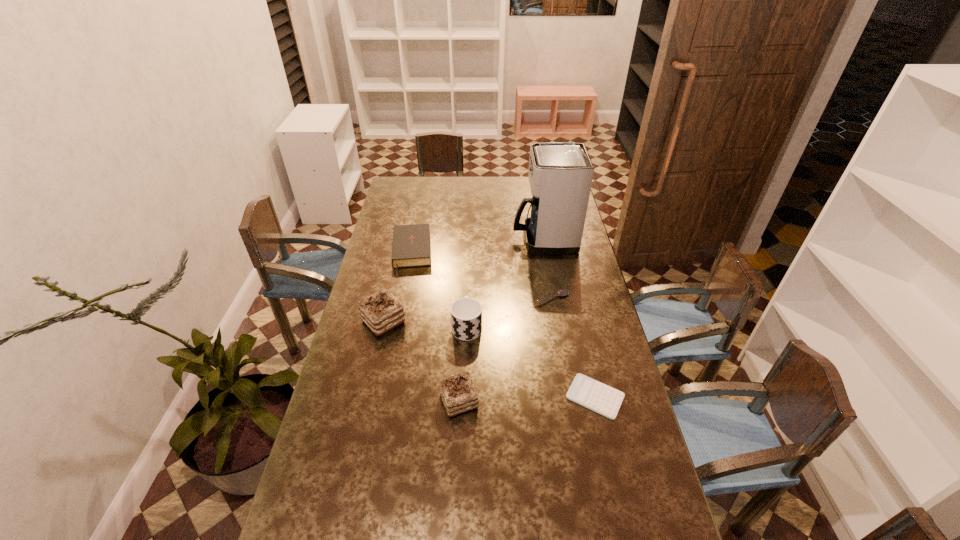
What are the coordinates of `chocolate cake positioned at the left edge` in the screenshot? It's located at (381, 311).

The width and height of the screenshot is (960, 540). Identify the location of Bible located in the left edge section of the desktop. (411, 247).

Image resolution: width=960 pixels, height=540 pixels. In order to click on coffee maker located at the right edge in this screenshot , I will do tap(560, 174).

This screenshot has height=540, width=960. I want to click on calculator at the right edge, so click(594, 395).

The image size is (960, 540). Identify the location of soupspoon that is positioned at the right edge. (562, 292).

Find the location of a particular element. This screenshot has width=960, height=540. free spot at the left edge of the desktop is located at coordinates (362, 348).

Where is `free space at the right edge`? free space at the right edge is located at coordinates (598, 429).

I want to click on free space that is in between the Bible and the calculator, so click(503, 325).

The image size is (960, 540). I want to click on blank region between the nearer chocolate cake and the Bible, so click(435, 327).

Identify the location of free space between the Bible and the cup. The height and width of the screenshot is (540, 960). (439, 290).